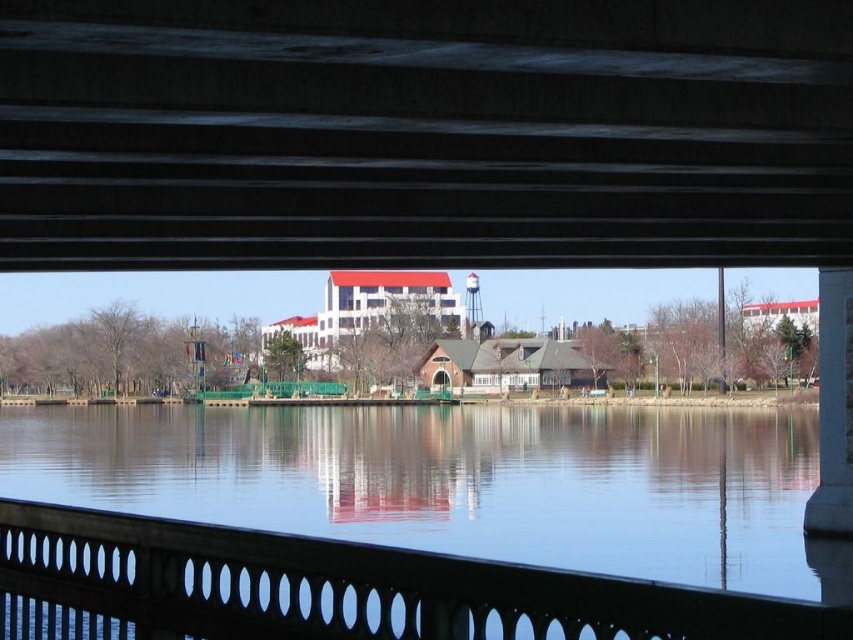
Between point (250, 237) and point (119, 531), which one is positioned in front?

Point (119, 531) is more forward.

At what (x,y) coordinates should I click in order to perform the action: click on concrete bridge at upper center. Please return your answer as a coordinate pair (x, y). Looking at the image, I should click on (424, 132).